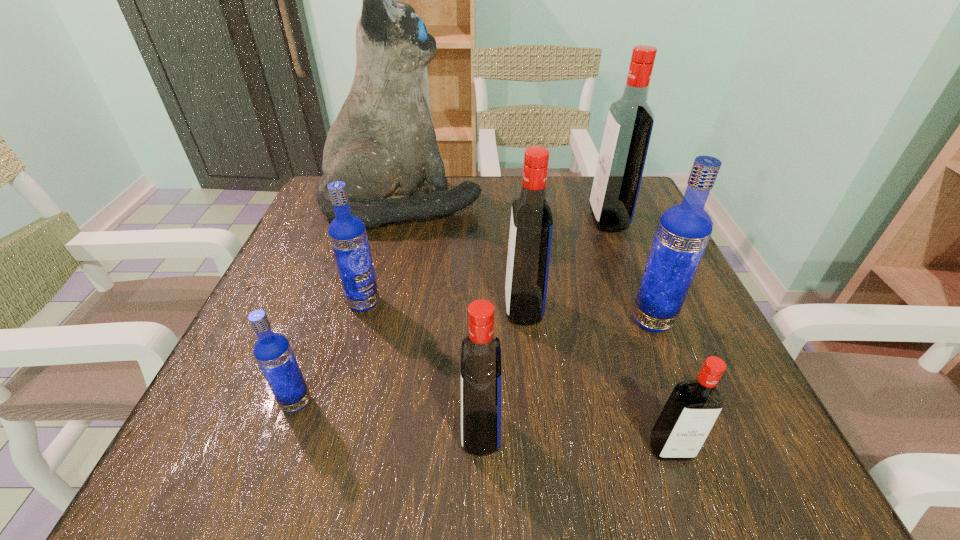
Identify the location of the tallest object. This screenshot has height=540, width=960. (383, 145).

You are a GUI agent. You are given a task and a screenshot of the screen. Output one action in this format:
    pyautogui.click(x=<x>, y=<y>)
    Task: Click on the farthest vodka
    This screenshot has height=540, width=960.
    Given the screenshot: What is the action you would take?
    pyautogui.click(x=630, y=120)

Locate an element on the screen. the farthest red vodka is located at coordinates (630, 120).

Identify the location of the biggest blue vodka. (683, 232).

You are a GUI agent. You are given a task and a screenshot of the screen. Output one action in this format:
    pyautogui.click(x=<x>, y=<y>)
    Task: Click on the fourth vodka from right to left
    This screenshot has width=960, height=540.
    Given the screenshot: What is the action you would take?
    pyautogui.click(x=531, y=224)

Where is `the second farthest red vodka`? The height and width of the screenshot is (540, 960). the second farthest red vodka is located at coordinates (531, 224).

This screenshot has width=960, height=540. Identify the location of the second biggest blue vodka. (347, 233).

The width and height of the screenshot is (960, 540). Identify the location of the second blue vodka from left to right. (347, 233).

Where is `the second smallest red vodka`? This screenshot has height=540, width=960. the second smallest red vodka is located at coordinates (481, 353).

Find the location of `the third vodka from left to right`. the third vodka from left to right is located at coordinates (481, 353).